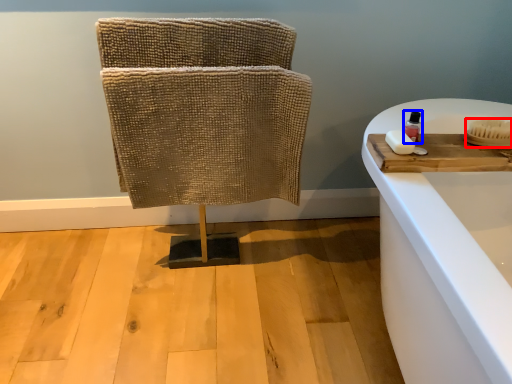
Question: Among these objects, which one is nearest to the camera, brush (highlighted by a red box) or toiletry (highlighted by a blue box)?

Choices:
 (A) brush
 (B) toiletry

Answer: (A)